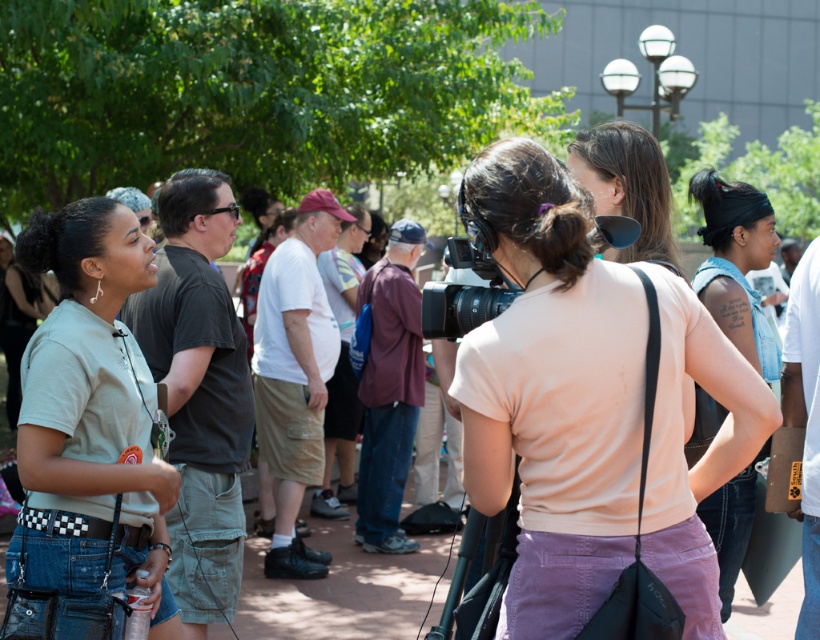
Question: Does denim shorts at left come in front of matte black video camera at center?

Choices:
 (A) yes
 (B) no

Answer: (B)

Question: Which of the following is the farthest from the observer?

Choices:
 (A) light pink cotton shirt at center
 (B) matte pink shirt at center
 (C) denim shorts at left

Answer: (A)

Question: In this image, where is denim shorts at left located relative to matte black video camera at center?

Choices:
 (A) left
 (B) right

Answer: (A)

Question: Where is denim shorts at left located in relation to matte black video camera at center in the image?

Choices:
 (A) right
 (B) left

Answer: (B)

Question: Which point is closer to the camera?

Choices:
 (A) (483, 308)
 (B) (522, 346)

Answer: (B)

Question: Which object appears farthest from the camera in this image?

Choices:
 (A) light pink cotton shirt at center
 (B) matte pink shirt at center
 (C) denim shorts at left

Answer: (A)